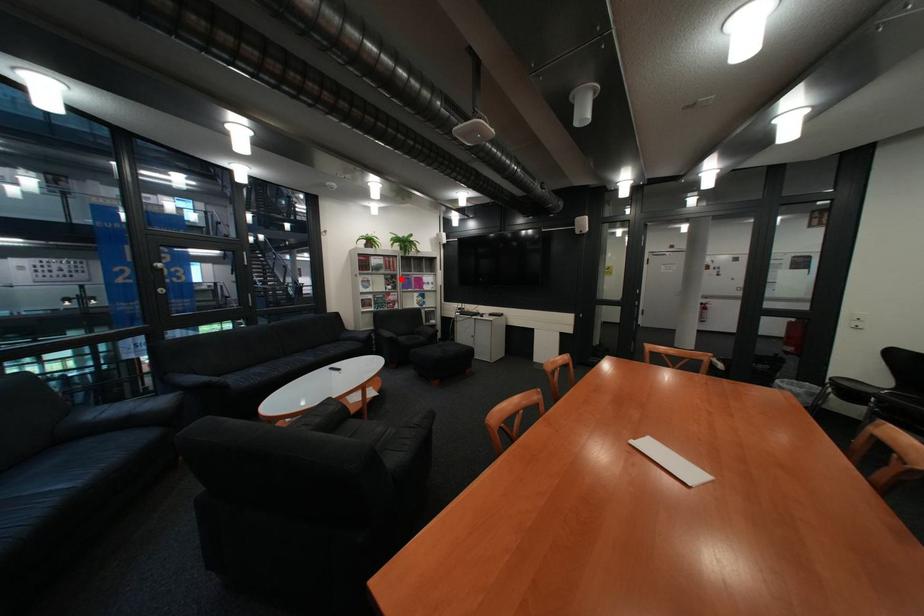
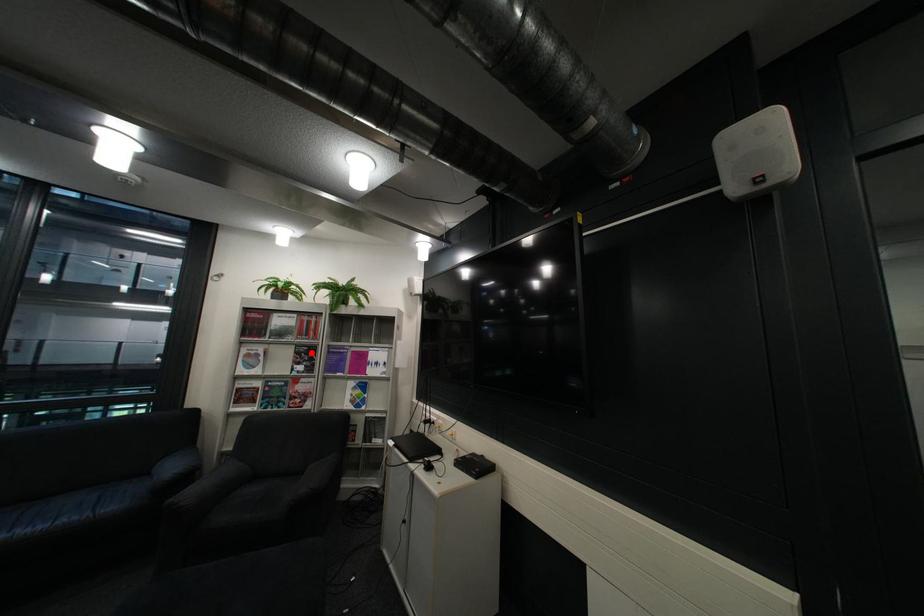
I am providing you with two images of the same scene from different viewpoints. A red point is marked on the first image and another point is marked on the second image. Does the point marked in image1 correspond to the same location as the one in image2?

Yes